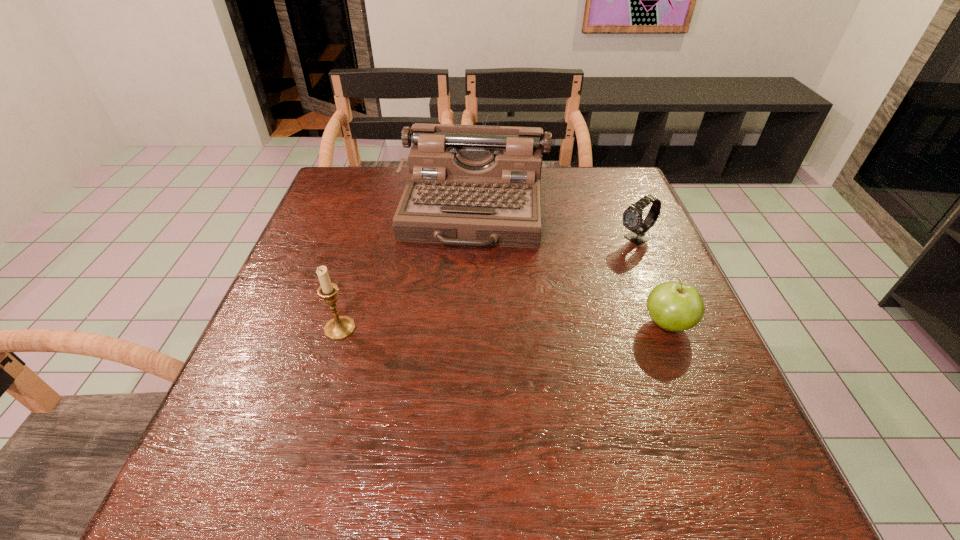
This screenshot has width=960, height=540. What are the coordinates of `vacant space located on the keyboard of the tallest object` in the screenshot? It's located at (451, 352).

At what (x,y) coordinates should I click in order to perform the action: click on free point located on the face of the watch. Please return your answer as a coordinate pair (x, y). Image resolution: width=960 pixels, height=540 pixels. Looking at the image, I should click on (538, 286).

Locate an element on the screen. free point located on the face of the watch is located at coordinates (593, 259).

You are a GUI agent. You are given a task and a screenshot of the screen. Output one action in this format:
    pyautogui.click(x=<x>, y=<y>)
    Task: Click on the blank area located 0.280m on the face of the watch
    
    Given the screenshot: What is the action you would take?
    pyautogui.click(x=534, y=288)

You are a GUI agent. You are given a task and a screenshot of the screen. Output one action in this format:
    pyautogui.click(x=<x>, y=<y>)
    Task: Click on the object situated at the far edge
    This screenshot has width=960, height=540.
    Given the screenshot: What is the action you would take?
    pos(473,185)

The width and height of the screenshot is (960, 540). Find the location of `object that is at the left edge`. object that is at the left edge is located at coordinates (340, 327).

The image size is (960, 540). I want to click on apple that is at the right edge, so click(674, 306).

Find the location of a particular element. watch present at the right edge is located at coordinates (632, 217).

Find the location of a particular element. The image size is (960, 540). vacant space at the left edge of the desktop is located at coordinates (281, 382).

At what (x,y) coordinates should I click in order to perform the action: click on free space at the right edge of the desktop. Please return your answer as a coordinate pair (x, y). Looking at the image, I should click on (662, 392).